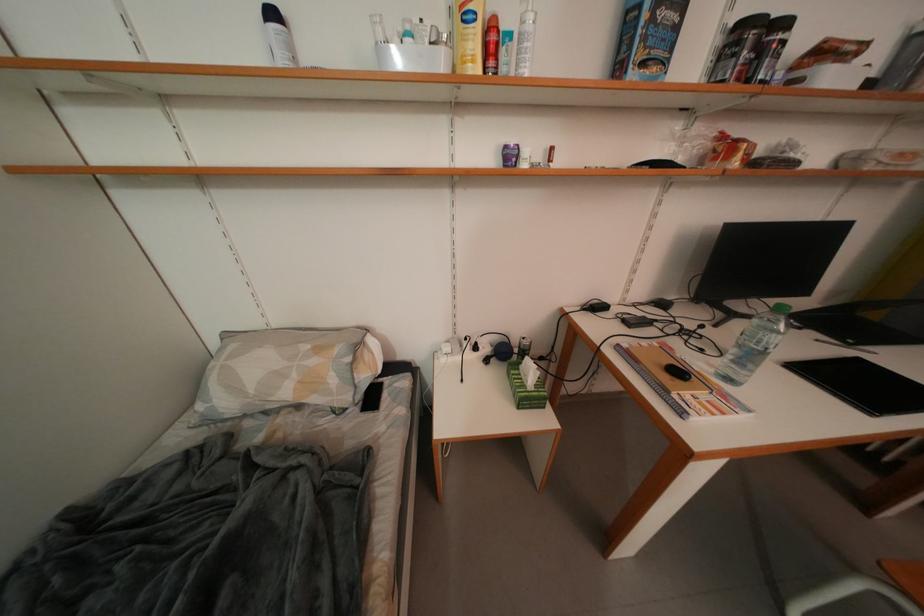
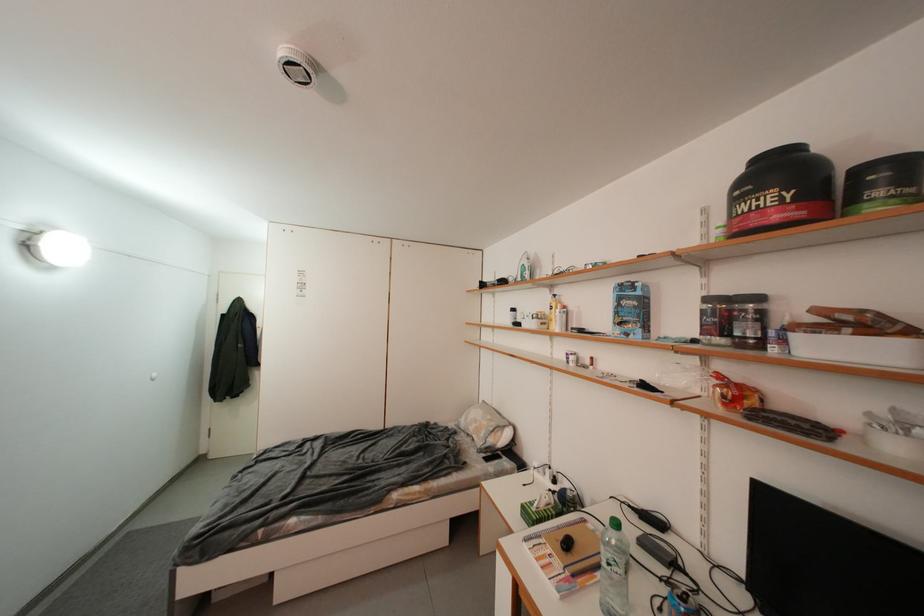
Find the pixel in the second image that matches pixel 749 164 in the first image.

(733, 408)